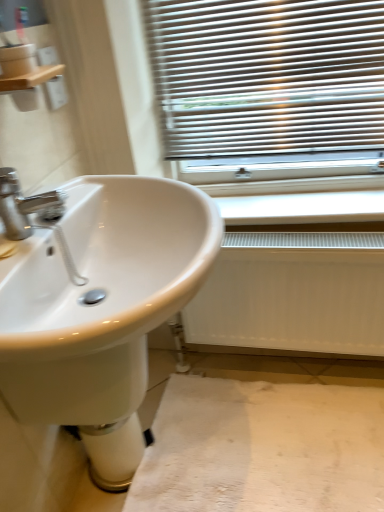
I want to click on free space above white matte radiator at lower right (from a real-world perspective), so click(261, 239).